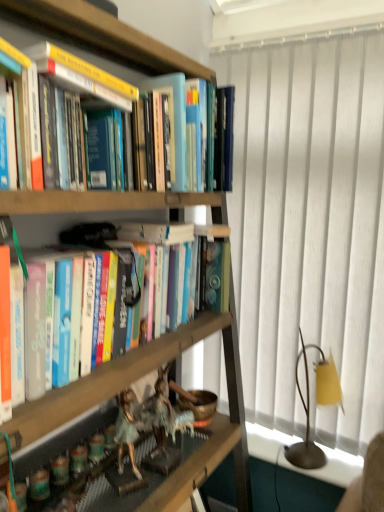
What do you see at coordinates (203, 468) in the screenshot? This screenshot has width=384, height=512. I see `metallic figurines at lower left` at bounding box center [203, 468].

Describe the element at coordinates (309, 408) in the screenshot. I see `yellow fabric lampshade at right` at that location.

The width and height of the screenshot is (384, 512). What do you see at coordinates (116, 374) in the screenshot? I see `hardcover books at center` at bounding box center [116, 374].

You are a GUI agent. You are given a task and a screenshot of the screen. Output one action in this format:
    pyautogui.click(x=<x>, y=<y>)
    Task: Click on the hardcover book at upper left, which is the 2th paperback book from back to front
    The width and height of the screenshot is (384, 512).
    Given the screenshot: What is the action you would take?
    pyautogui.click(x=82, y=76)

Measure the distance between hardcover book at upper left, which is the 2th paperback book from back to front, and camera.

A distance of 30.71 inches exists between hardcover book at upper left, which is the 2th paperback book from back to front, and camera.

I want to click on wooden bookcase at left, so click(x=106, y=36).

How far apart are wooden bookcase at left and hardcover books at center?

75.70 centimeters.

From the picture: Who is more distant, wooden bookcase at left or hardcover books at center?

Positioned behind is hardcover books at center.

Considering the relative sizes of wooden bookcase at left and hardcover books at center in the image provided, is wooden bookcase at left thinner than hardcover books at center?

No.

In the image, is wooden bookcase at left on the left side or the right side of hardcover books at center?

wooden bookcase at left is positioned on hardcover books at center's right side.

Is wooden bookcase at left facing away from metallic figurines at lower left?

That's right, wooden bookcase at left is facing away from metallic figurines at lower left.

Is wooden bookcase at left positioned behind metallic figurines at lower left?

No, it is in front of metallic figurines at lower left.

Which is more to the left, wooden bookcase at left or metallic figurines at lower left?

metallic figurines at lower left is more to the left.

Is point (243, 425) closer to camera compared to point (226, 421)?

No.

Considering the sizes of blue hardcover book at upper center, the 2th paperback book positioned from the front, and hardcover books at center in the image, is blue hardcover book at upper center, the 2th paperback book positioned from the front, bigger or smaller than hardcover books at center?

Considering their sizes, blue hardcover book at upper center, the 2th paperback book positioned from the front, takes up less space than hardcover books at center.

From a real-world perspective, relative to hardcover books at center, is blue hardcover book at upper center, the 2th paperback book positioned from the front, vertically above or below?

blue hardcover book at upper center, the 2th paperback book positioned from the front, is situated higher than hardcover books at center in the real world.

Considering the positions of points (173, 129) and (99, 382), is point (173, 129) farther from camera compared to point (99, 382)?

Yes, it is.

Measure the distance from wooden bookcase at left to blue hardcover book at upper center, the first paperback book when ordered from back to front.

wooden bookcase at left and blue hardcover book at upper center, the first paperback book when ordered from back to front, are 8.00 inches apart.

Is blue hardcover book at upper center, the first paperback book when ordered from back to front, at the back of wooden bookcase at left?

Absolutely, wooden bookcase at left is directed away from blue hardcover book at upper center, the first paperback book when ordered from back to front.

Can you confirm if wooden bookcase at left is positioned to the left of blue hardcover book at upper center, the first paperback book when ordered from back to front?

Indeed, wooden bookcase at left is positioned on the left side of blue hardcover book at upper center, the first paperback book when ordered from back to front.

Considering their positions, is wooden bookcase at left located in front of or behind blue hardcover book at upper center, the first paperback book when ordered from back to front?

wooden bookcase at left is positioned closer to the viewer than blue hardcover book at upper center, the first paperback book when ordered from back to front.

Who is more distant, blue hardcover book at upper center, the first paperback book when ordered from back to front, or metallic figurines at lower left?

blue hardcover book at upper center, the first paperback book when ordered from back to front, is more distant.

Which point is more forward, (184, 142) or (237, 455)?

The point (184, 142) is closer to the camera.

Considering the sizes of objects blue hardcover book at upper center, the first paperback book when ordered from back to front, and metallic figurines at lower left in the image provided, who is shorter, blue hardcover book at upper center, the first paperback book when ordered from back to front, or metallic figurines at lower left?

metallic figurines at lower left.

From a real-world perspective, which is physically above, blue hardcover book at upper center, the 2th paperback book positioned from the front, or metallic figurines at lower left?

blue hardcover book at upper center, the 2th paperback book positioned from the front, from a real-world perspective.

From the picture: Is hardcover book at upper left, marked as the 1th paperback book in a front-to-back arrangement, at the left side of blue hardcover book at upper center, the 2th paperback book positioned from the front?

Yes, hardcover book at upper left, marked as the 1th paperback book in a front-to-back arrangement, is to the left of blue hardcover book at upper center, the 2th paperback book positioned from the front.

Which of these two, hardcover book at upper left, which is the 2th paperback book from back to front, or blue hardcover book at upper center, the 2th paperback book positioned from the front, stands shorter?

Standing shorter between the two is hardcover book at upper left, which is the 2th paperback book from back to front.

Considering the sizes of hardcover book at upper left, marked as the 1th paperback book in a front-to-back arrangement, and blue hardcover book at upper center, the 2th paperback book positioned from the front, in the image, is hardcover book at upper left, marked as the 1th paperback book in a front-to-back arrangement, bigger or smaller than blue hardcover book at upper center, the 2th paperback book positioned from the front,?

Considering their sizes, hardcover book at upper left, marked as the 1th paperback book in a front-to-back arrangement, takes up more space than blue hardcover book at upper center, the 2th paperback book positioned from the front.

Is point (225, 421) in front of point (304, 468)?

That is False.

In the scene shown: From a real-world perspective, is metallic figurines at lower left located higher than yellow fabric lampshade at right?

Incorrect, from a real-world perspective, metallic figurines at lower left is lower than yellow fabric lampshade at right.

Is metallic figurines at lower left surrounding yellow fabric lampshade at right?

No, yellow fabric lampshade at right is not a part of metallic figurines at lower left.

The image size is (384, 512). I want to click on book above the wooden bookcase at left (from the image's perspective), so 116,374.

Image resolution: width=384 pixels, height=512 pixels. I want to click on table that is under the wooden bookcase at left (from a real-world perspective), so (203, 468).

Which object lies nearer to the anchor point hardcover books at center, metallic figurines at lower left or yellow fabric lampshade at right?

metallic figurines at lower left is closer to hardcover books at center.

Based on the photo, when comparing their distances from hardcover book at upper left, which is the 2th paperback book from back to front, does white textured curtain at right or wooden bookcase at left seem further?

white textured curtain at right.

Considering their positions, is hardcover book at upper left, marked as the 1th paperback book in a front-to-back arrangement, positioned closer to hardcover books at center than metallic figurines at lower left?

metallic figurines at lower left.

Based on their spatial positions, is yellow fabric lampshade at right or metallic figurines at lower left closer to white textured curtain at right?

yellow fabric lampshade at right is closer to white textured curtain at right.

Estimate the real-world distances between objects in this image. Which object is closer to wooden bookcase at left, hardcover book at upper left, which is the 2th paperback book from back to front, or white textured curtain at right?

hardcover book at upper left, which is the 2th paperback book from back to front.

From the image, which object appears to be nearer to blue hardcover book at upper center, the first paperback book when ordered from back to front, hardcover book at upper left, which is the 2th paperback book from back to front, or white textured curtain at right?

hardcover book at upper left, which is the 2th paperback book from back to front.

Looking at the image, which one is located further to metallic figurines at lower left, blue hardcover book at upper center, the first paperback book when ordered from back to front, or hardcover books at center?

blue hardcover book at upper center, the first paperback book when ordered from back to front, is positioned further to the anchor metallic figurines at lower left.

Based on their spatial positions, is yellow fabric lampshade at right or hardcover book at upper left, which is the 2th paperback book from back to front, closer to white textured curtain at right?

A: yellow fabric lampshade at right lies closer to white textured curtain at right than the other object.

Locate an element on the screen. This screenshot has height=512, width=384. paperback book between hardcover book at upper left, which is the 2th paperback book from back to front, and metallic figurines at lower left from top to bottom is located at coordinates (173, 123).

Locate an element on the screen. The image size is (384, 512). book between hardcover book at upper left, which is the 2th paperback book from back to front, and wooden bookcase at left vertically is located at coordinates [x=116, y=374].

The image size is (384, 512). Identify the location of lamp between hardcover book at upper left, marked as the 1th paperback book in a front-to-back arrangement, and metallic figurines at lower left from top to bottom. (309, 408).

The image size is (384, 512). I want to click on lamp between blue hardcover book at upper center, the 2th paperback book positioned from the front, and metallic figurines at lower left from top to bottom, so click(309, 408).